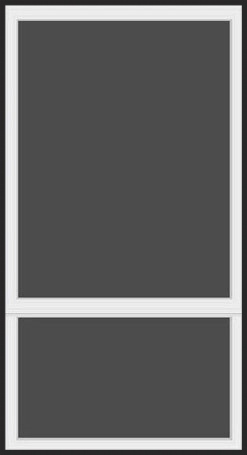
Locate an element on the screen. The height and width of the screenshot is (455, 247). photo frame is located at coordinates (13, 393), (13, 287).